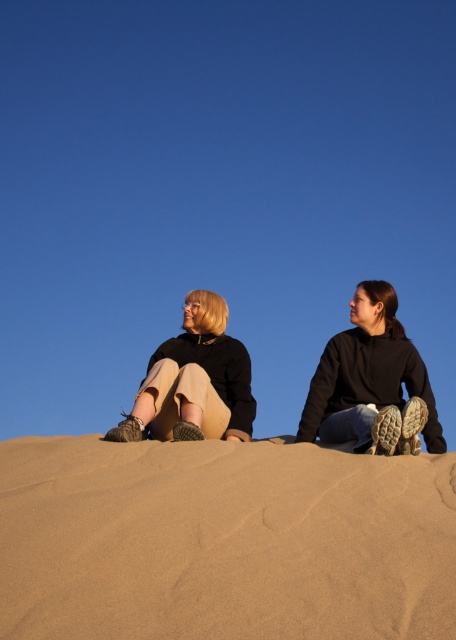
You are a photographer standing behind the two people on the sandy dunes. You want to capture a photo where the brown sandy dunes at center and the matte black jackets at center are both clearly visible. Given that your camera has a depth of field that can focus sharply on objects within 1.4 meters, will both subjects be in focus?

The brown sandy dunes at center is 1.45 meters from matte black jackets at center. Since the distance between them is slightly more than the camera lens depth of field of 1.4 meters, both subjects may not be in focus simultaneously.

You are planning to place a rectangular object that is 1 meter wide between the black hoodie at upper right and the matte black sweater at center. Based on the scene, can you determine if there is enough space between them for the object?

The black hoodie at upper right might be wider than matte black sweater at center, so it is uncertain if there is enough space to place a 1 meter wide object between them. Check the actual distance before placing the object.

Looking at this image, you are a photographer trying to capture the matte black jackets at center in the image. Where exactly should you focus your camera to ensure the jackets are in the center of the photo?

You should focus your camera at point (372, 384) to ensure the matte black jackets at center are in the center of the photo.